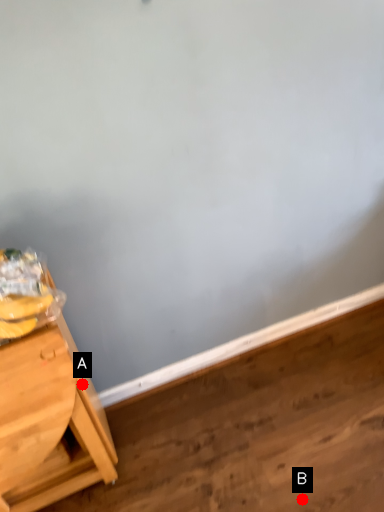
Question: Two points are circled on the image, labeled by A and B beside each circle. Which point is farther to the camera?

Choices:
 (A) A is further
 (B) B is further

Answer: (B)